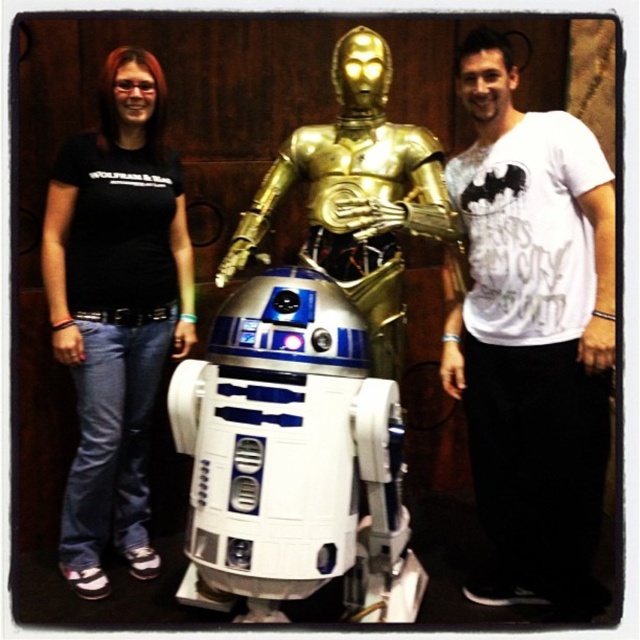
Can you confirm if white cotton t-shirt at right is smaller than black cotton shirt at left?

Actually, white cotton t-shirt at right might be larger than black cotton shirt at left.

Is white cotton t-shirt at right thinner than black cotton shirt at left?

No.

Who is more distant from viewer, (547,396) or (115,51)?

The point (115,51) is more distant.

Locate an element on the screen. white cotton t-shirt at right is located at coordinates click(x=532, y=333).

Who is more forward, (556,388) or (396,189)?

Point (556,388)

Is white cotton t-shirt at right bigger than gold metallic armor at center?

Yes, white cotton t-shirt at right is bigger than gold metallic armor at center.

Is point (595, 472) more distant than point (252, 227)?

No, (595, 472) is closer to viewer.

Where is `white cotton t-shirt at right`? white cotton t-shirt at right is located at coordinates (532, 333).

Can you confirm if black cotton shirt at left is positioned to the right of gold metallic armor at center?

Incorrect, black cotton shirt at left is not on the right side of gold metallic armor at center.

Does black cotton shirt at left have a lesser width compared to gold metallic armor at center?

Correct, black cotton shirt at left's width is less than gold metallic armor at center's.

Which is behind, point (113, 314) or point (310, 125)?

The point (310, 125) is behind.

This screenshot has height=640, width=640. Find the location of `black cotton shirt at left`. black cotton shirt at left is located at coordinates (116, 308).